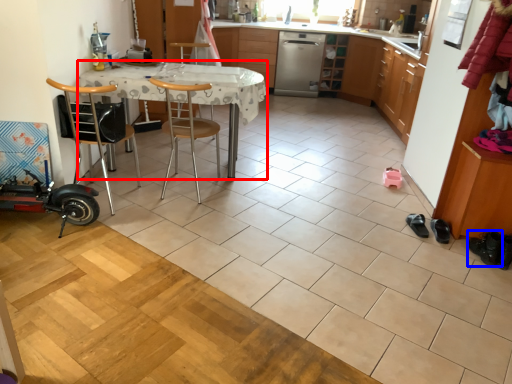
Question: Which point is closer to the camera, desk (highlighted by a red box) or footwear (highlighted by a blue box)?

Choices:
 (A) desk
 (B) footwear

Answer: (B)